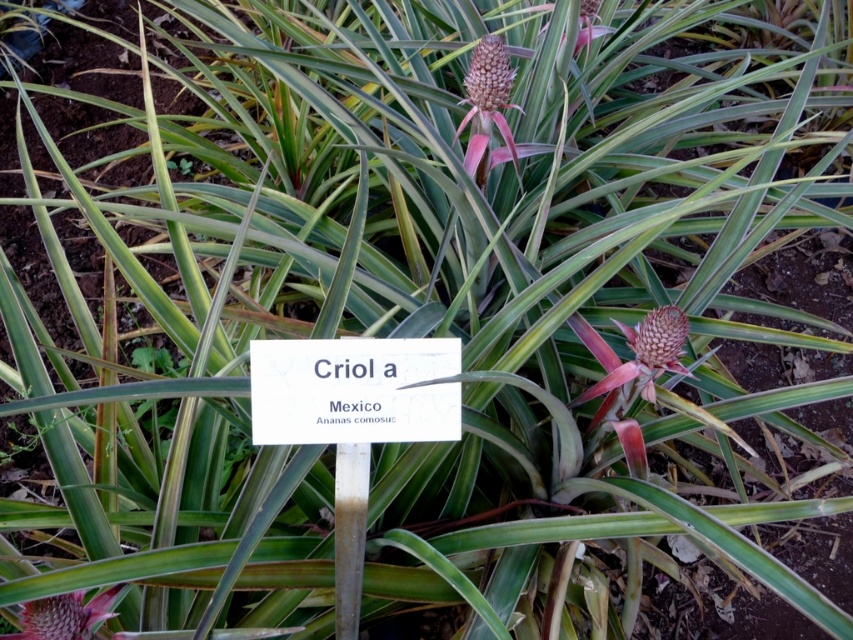
Question: Which of these objects is positioned closest to the pink spiky pineapple at center?

Choices:
 (A) pink spiky pineapple at upper center
 (B) brown fuzzy pineapple at center
 (C) white paper sign at center

Answer: (C)

Question: Does white paper sign at center appear on the right side of pink spiky pineapple at center?

Choices:
 (A) no
 (B) yes

Answer: (B)

Question: Which is nearer to the white paper sign at center?

Choices:
 (A) brown fuzzy pineapple at center
 (B) pink spiky pineapple at center
 (C) pink spiky pineapple at upper center

Answer: (B)

Question: Does white paper sign at center have a lesser width compared to pink spiky pineapple at center?

Choices:
 (A) yes
 (B) no

Answer: (B)

Question: Is pink spiky pineapple at center above brown fuzzy pineapple at center?

Choices:
 (A) yes
 (B) no

Answer: (B)

Question: Among these objects, which one is farthest from the camera?

Choices:
 (A) white paper sign at center
 (B) brown fuzzy pineapple at center
 (C) pink spiky pineapple at upper center

Answer: (C)